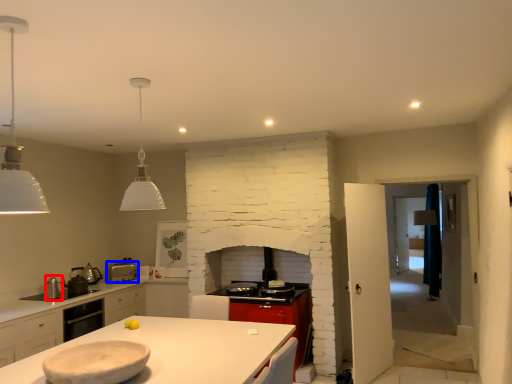
Question: Which object appears closest to the camera in this image, appliance (highlighted by a red box) or kitchen appliance (highlighted by a blue box)?

Choices:
 (A) appliance
 (B) kitchen appliance

Answer: (A)